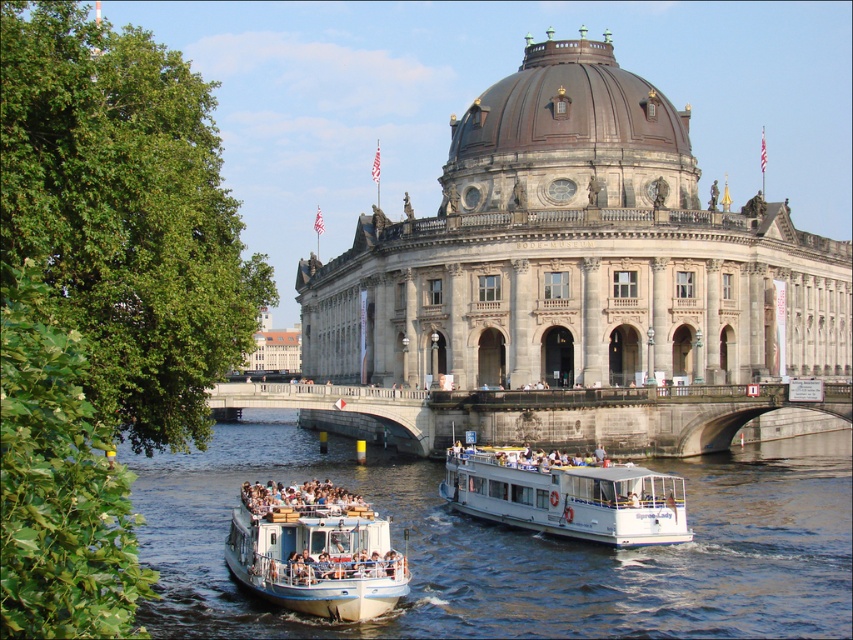
You are a tourist standing on the riverbank near the Bode Museum. You see the blue water at lower center and the white matte boat at center. Which one appears larger in the image?

The blue water at lower center appears larger than the white matte boat at center in the image.

You are a tourist standing on the dock and want to take a photo of the gray stone building at center and the blue water at lower center. Which object is closer to you?

The blue water at lower center is closer to you because the gray stone building at center is positioned over it, meaning the building is further away.

You are standing at the Bode Museum and want to cross the river to the other side. There is a stone bridge at center located at point (544, 413). Is the stone bridge at center the closest point to the Bode Museum where you can cross the river?

The stone bridge at center is located at point (544, 413), so yes, it is the closest point to the Bode Museum where you can cross the river.